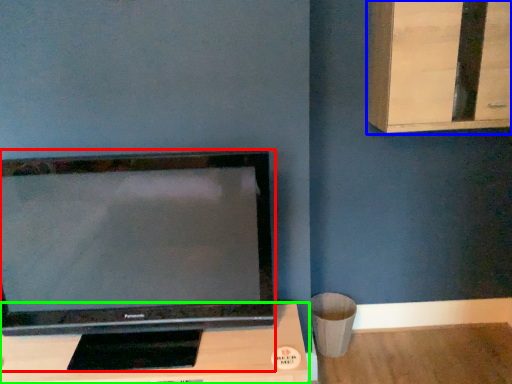
Question: Estimate the real-world distances between objects in this image. Which object is closer to television (highlighted by a red box), dresser (highlighted by a blue box) or furniture (highlighted by a green box)?

Choices:
 (A) dresser
 (B) furniture

Answer: (B)